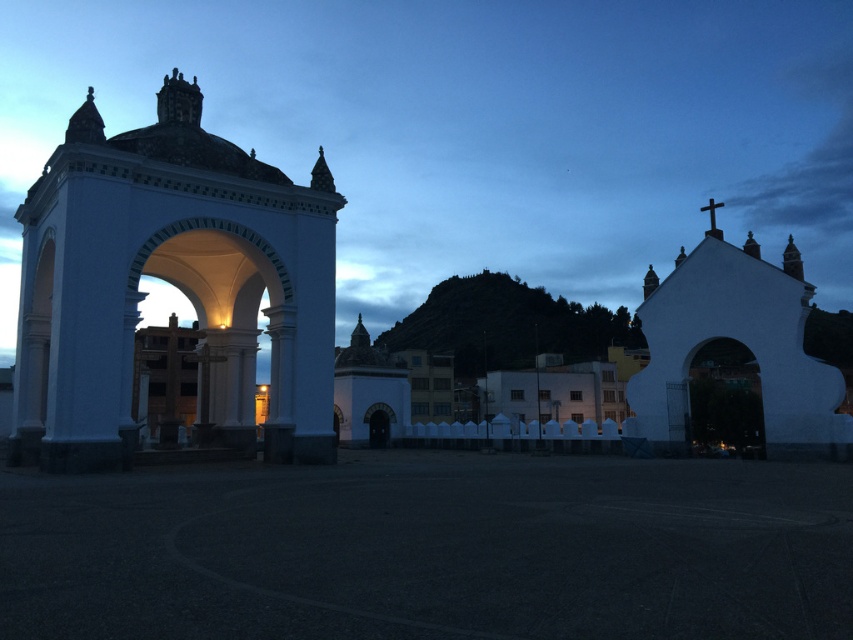
You are a tour guide leading a group to a historical site. You want to take a photo that includes both the white stone arch at left and the white matte church at right. What is the minimum distance you need to move backward to fit both structures in the frame?

The white stone arch at left and white matte church at right are 36.40 meters apart. To fit both in the frame, you need to move back at least 36.40 meters.

You are standing in the plaza and want to take a photo of the white stone arch at left. The camera you are using can focus on objects up to 40 meters away. Will the arch be in focus?

The white stone arch at left is 41.58 meters from camera, which is beyond the camera focus limit of 40 meters. The arch will not be in focus.